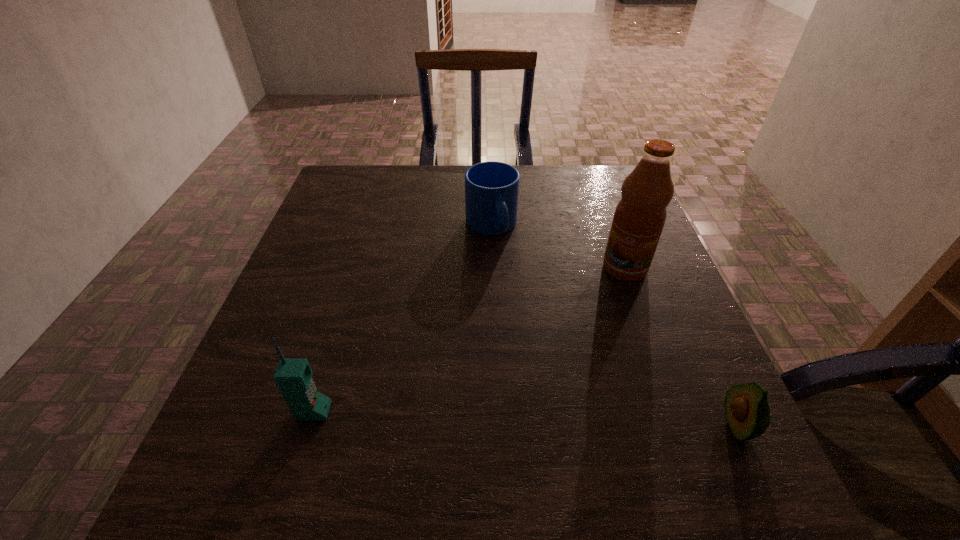
Locate an element on the screen. object that is at the left edge is located at coordinates (293, 376).

Where is `avocado that is positioned at the right edge`? The height and width of the screenshot is (540, 960). avocado that is positioned at the right edge is located at coordinates (747, 411).

This screenshot has height=540, width=960. Find the location of `fruit juice located at the right edge`. fruit juice located at the right edge is located at coordinates (639, 218).

At what (x,y) coordinates should I click in order to perform the action: click on object that is positioned at the near left corner. Please return your answer as a coordinate pair (x, y). Looking at the image, I should click on (293, 376).

Identify the location of object that is at the near right corner. tap(747, 411).

Identify the location of free location at the far edge. The image size is (960, 540). (556, 177).

Where is `free space at the near edge`? free space at the near edge is located at coordinates (528, 446).

This screenshot has width=960, height=540. Find the location of `vacant space at the left edge of the desktop`. vacant space at the left edge of the desktop is located at coordinates (351, 280).

You are a GUI agent. You are given a task and a screenshot of the screen. Output one action in this format:
    pyautogui.click(x=<x>, y=<y>)
    Task: Click on the free location at the right edge
    The height and width of the screenshot is (540, 960).
    Given the screenshot: What is the action you would take?
    pyautogui.click(x=624, y=351)

In the image, there is a desktop. Where is `vacant space at the near right corner`? This screenshot has height=540, width=960. vacant space at the near right corner is located at coordinates (678, 422).